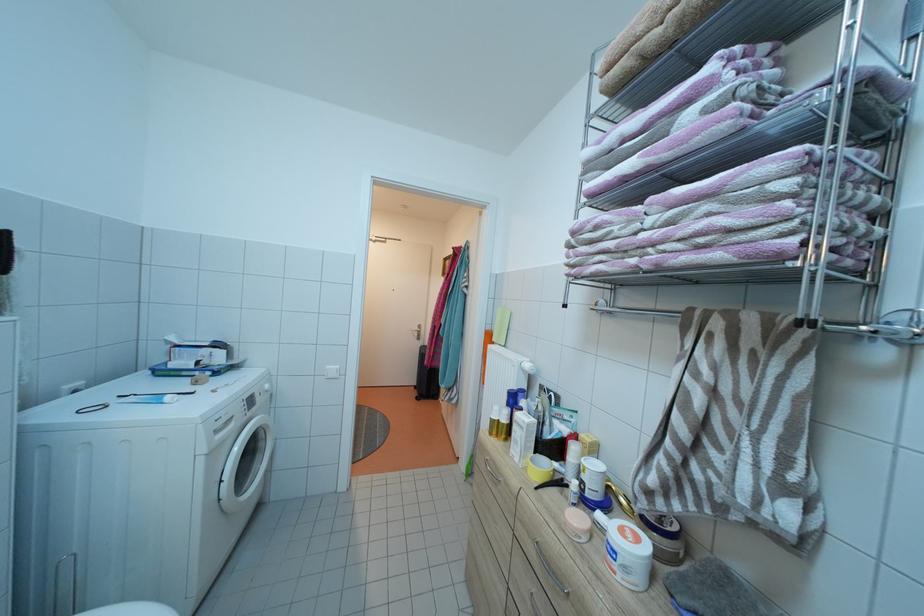
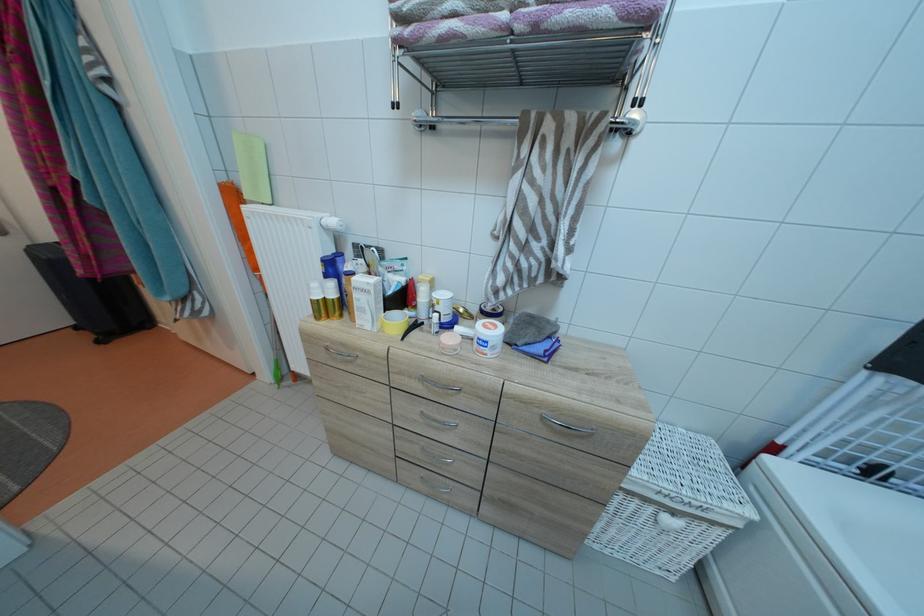
Where in the second image is the point corresponding to (535,371) from the first image?

(341, 227)